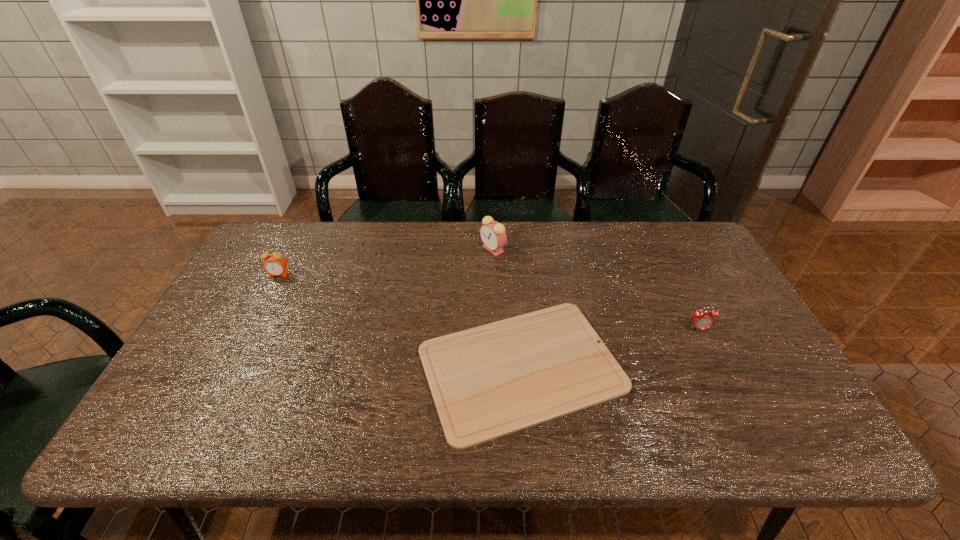
Identify the location of free space that is in between the farthest object and the rightmost object. (596, 289).

This screenshot has height=540, width=960. I want to click on vacant space that's between the shortest object and the farthest object, so click(507, 308).

I want to click on object that stands as the second closest to the nearest alarm clock, so click(x=493, y=235).

Identify which object is located as the third nearest to the chopping board. Please provide its 2D coordinates. Your answer should be formatted as a tuple, i.e. [(x, y)], where the tuple contains the x and y coordinates of a point satisfying the conditions above.

[(275, 264)]

You are a GUI agent. You are given a task and a screenshot of the screen. Output one action in this format:
    pyautogui.click(x=<x>, y=<y>)
    Task: Click on the alarm clock that is the second closest to the nearest alarm clock
    
    Given the screenshot: What is the action you would take?
    pyautogui.click(x=275, y=264)

Identify which alarm clock is located as the second nearest to the second alarm clock from right to left. Please provide its 2D coordinates. Your answer should be formatted as a tuple, i.e. [(x, y)], where the tuple contains the x and y coordinates of a point satisfying the conditions above.

[(275, 264)]

This screenshot has width=960, height=540. I want to click on free space that satisfies the following two spatial constraints: 1. on the face of the farthest alarm clock; 2. on the face of the second farthest object, so [493, 275].

Image resolution: width=960 pixels, height=540 pixels. In order to click on free region that satisfies the following two spatial constraints: 1. on the face of the shortest object; 2. on the right side of the farthest alarm clock in this screenshot , I will do `click(497, 368)`.

Locate an element on the screen. The width and height of the screenshot is (960, 540). free spot that satisfies the following two spatial constraints: 1. on the face of the farthest object; 2. on the face of the leftmost alarm clock is located at coordinates (493, 275).

The image size is (960, 540). In order to click on vacant space that satisfies the following two spatial constraints: 1. on the back side of the chopping board; 2. on the face of the farthest alarm clock in this screenshot , I will do `click(511, 249)`.